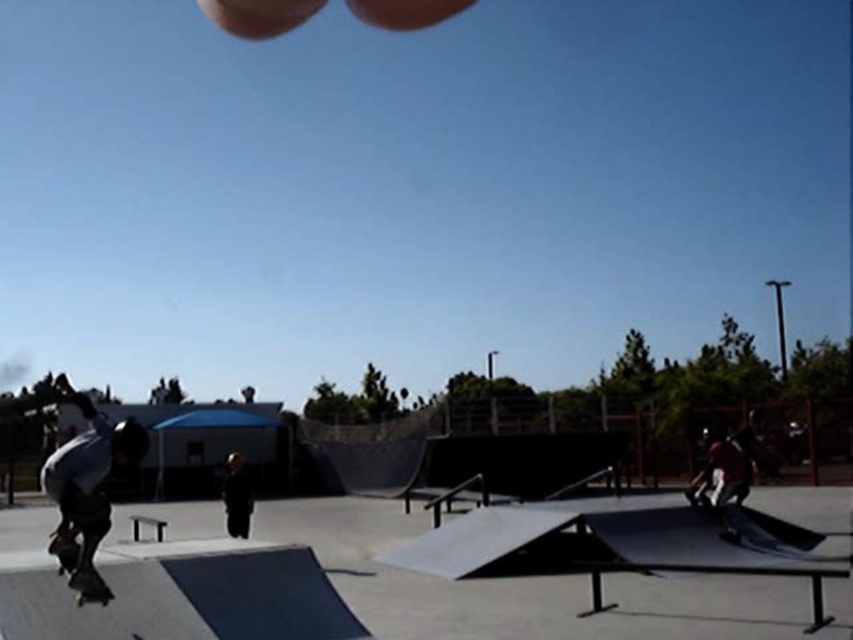
Does point (782, 605) come behind point (88, 579)?

That is True.

Measure the distance between smooth concrete ramp at center and camera.

5.28 meters

Does point (215, 540) come behind point (82, 560)?

Yes, it is.

Locate an element on the screen. This screenshot has height=640, width=853. smooth concrete ramp at center is located at coordinates (355, 573).

Does smooth concrete ramp at center come in front of dark gray matte skateboarder at lower left?

No, smooth concrete ramp at center is behind dark gray matte skateboarder at lower left.

Can you confirm if smooth concrete ramp at center is positioned to the left of dark gray matte skateboarder at lower left?

No, smooth concrete ramp at center is not to the left of dark gray matte skateboarder at lower left.

Locate an element on the screen. This screenshot has height=640, width=853. smooth concrete ramp at center is located at coordinates (355, 573).

Is dark gray matte skateboarder at lower left above black matte skateboard at lower left?

Incorrect, dark gray matte skateboarder at lower left is not positioned above black matte skateboard at lower left.

Is point (84, 532) in front of point (55, 534)?

Yes.

Image resolution: width=853 pixels, height=640 pixels. Identify the location of dark gray matte skateboarder at lower left. (86, 490).